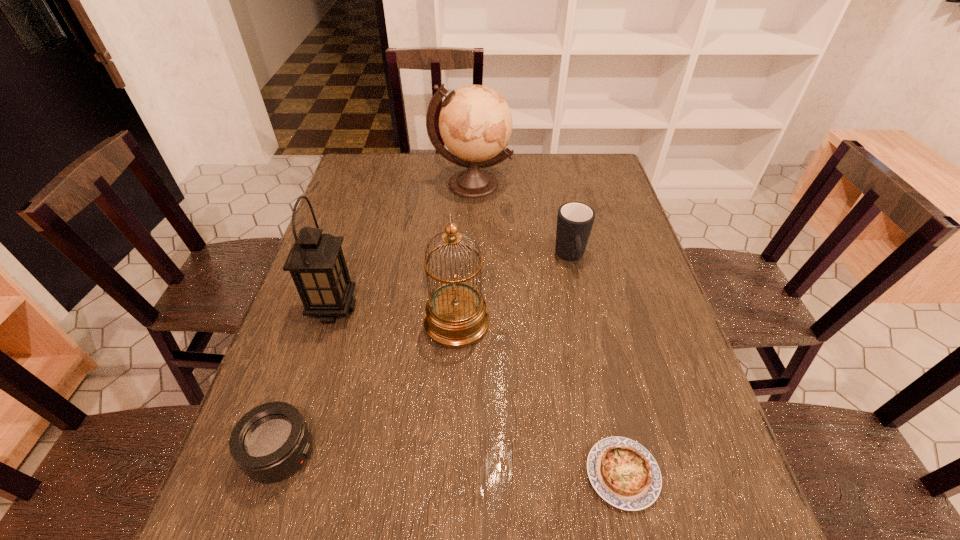
Where is `free space between the second shortest object and the farthest object`? The image size is (960, 540). free space between the second shortest object and the farthest object is located at coordinates (376, 319).

The height and width of the screenshot is (540, 960). Find the location of `object that is the fourth closest to the birdcage`. object that is the fourth closest to the birdcage is located at coordinates (624, 473).

Find the location of a particular element. This screenshot has width=960, height=540. object that is the closest to the birdcage is located at coordinates (316, 262).

Where is `free region that satisfies the following two spatial constraints: 1. with an open door on the birdcage; 2. on the left side of the quiche`? Image resolution: width=960 pixels, height=540 pixels. free region that satisfies the following two spatial constraints: 1. with an open door on the birdcage; 2. on the left side of the quiche is located at coordinates point(449,474).

Find the location of `vacant space that satisfies the following two spatial constraints: 1. on the side of the telephoto lens with brand markings and control switches; 2. on the right side of the shortest object`. vacant space that satisfies the following two spatial constraints: 1. on the side of the telephoto lens with brand markings and control switches; 2. on the right side of the shortest object is located at coordinates (275, 474).

I want to click on vacant space that satisfies the following two spatial constraints: 1. on the side of the fourth tallest object with the handle; 2. on the left side of the shortest object, so click(616, 474).

The width and height of the screenshot is (960, 540). What are the coordinates of `vacant space that satisfies the following two spatial constraints: 1. on the front-facing side of the globe; 2. on the right side of the quiche` in the screenshot? It's located at (465, 474).

Locate an element on the screen. This screenshot has width=960, height=540. free location that satisfies the following two spatial constraints: 1. on the side of the telephoto lens with brand markings and control switches; 2. on the right side of the quiche is located at coordinates (275, 474).

The height and width of the screenshot is (540, 960). I want to click on free region that satisfies the following two spatial constraints: 1. on the side of the third shortest object with the handle; 2. on the side of the telephoto lens with brand markings and control switches, so click(x=612, y=453).